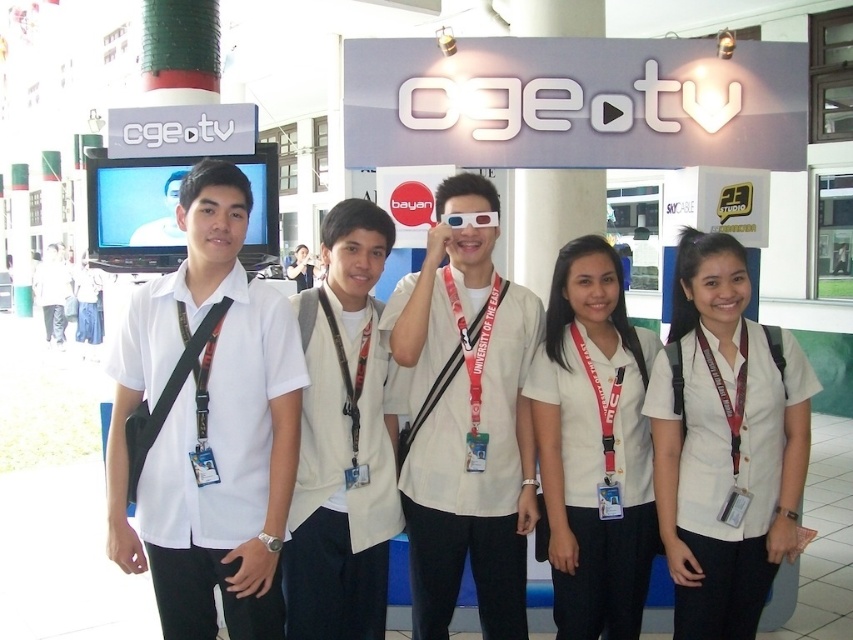
Which is below, white matte shirt at left or white fabric shirt at center?

white fabric shirt at center is below.

Is white matte shirt at left positioned in front of white fabric shirt at center?

Yes, it is in front of white fabric shirt at center.

The image size is (853, 640). Describe the element at coordinates (207, 424) in the screenshot. I see `white matte shirt at left` at that location.

Locate an element on the screen. The width and height of the screenshot is (853, 640). white matte shirt at left is located at coordinates (207, 424).

Does white matte shirt at left lie behind white matte uniform at center?

That is False.

Measure the distance between white matte shirt at left and camera.

white matte shirt at left and camera are 2.67 meters apart from each other.

Where is `white matte shirt at left`? The width and height of the screenshot is (853, 640). white matte shirt at left is located at coordinates (207, 424).

Does white fabric shirt at center have a lesser width compared to white matte shirt at center?

No, white fabric shirt at center is not thinner than white matte shirt at center.

This screenshot has height=640, width=853. Describe the element at coordinates (473, 458) in the screenshot. I see `white fabric shirt at center` at that location.

Where is `white fabric shirt at center`? The width and height of the screenshot is (853, 640). white fabric shirt at center is located at coordinates (473, 458).